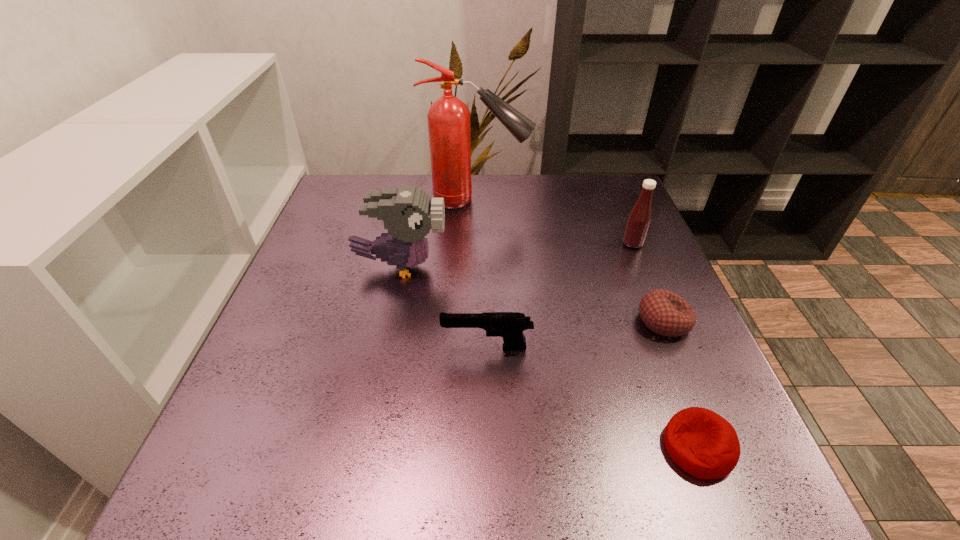
Locate an element on the screen. vacant space that satisfies the following two spatial constraints: 1. at the nozzle end of the farther beanbag; 2. on the right side of the farthest object is located at coordinates (476, 321).

I want to click on free location that satisfies the following two spatial constraints: 1. on the back side of the fourth farthest object; 2. at the nozzle end of the farthest object, so click(x=613, y=200).

Where is `free spot that satisfies the following two spatial constraints: 1. at the beak of the third farthest object; 2. on the right side of the fourth farthest object`? The image size is (960, 540). free spot that satisfies the following two spatial constraints: 1. at the beak of the third farthest object; 2. on the right side of the fourth farthest object is located at coordinates (390, 321).

The width and height of the screenshot is (960, 540). I want to click on vacant region that satisfies the following two spatial constraints: 1. on the back side of the fifth nearest object; 2. at the nozzle end of the fire extinguisher, so click(614, 200).

Locate an element on the screen. free space in the image that satisfies the following two spatial constraints: 1. at the nozzle end of the fire extinguisher; 2. on the back side of the third nearest object is located at coordinates (476, 321).

I want to click on blank area in the image that satisfies the following two spatial constraints: 1. at the nozzle end of the fire extinguisher; 2. on the back side of the Tabasco sauce, so click(x=476, y=244).

Where is `free region that satisfies the following two spatial constraints: 1. on the front side of the fifth nearest object; 2. at the beak of the fourth nearest object`? The image size is (960, 540). free region that satisfies the following two spatial constraints: 1. on the front side of the fifth nearest object; 2. at the beak of the fourth nearest object is located at coordinates (642, 267).